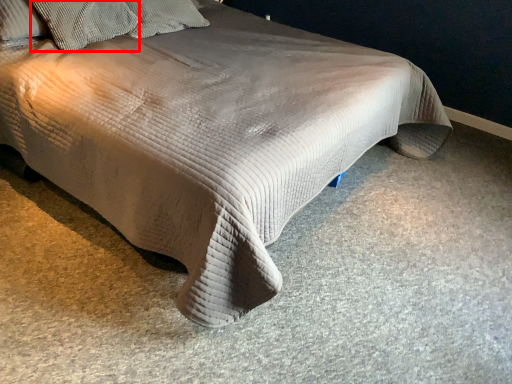
Question: From the image, what is the correct spatial relationship of pillow (annotated by the red box) in relation to pillow?

Choices:
 (A) left
 (B) right

Answer: (A)